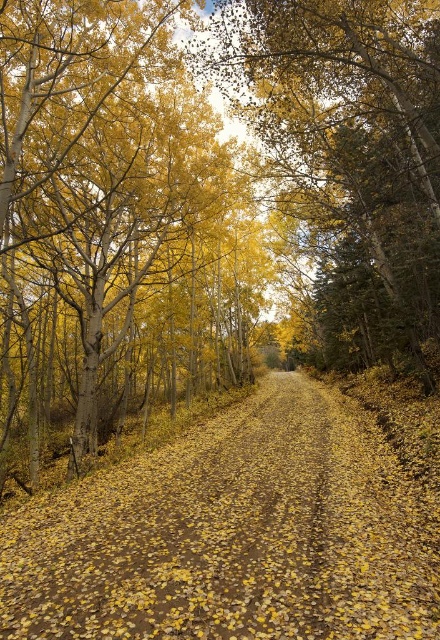
You are a hiker walking along the yellow leafy dirt path at center and the golden textured leaves at center. Which object appears smaller in the scene?

The yellow leafy dirt path at center appears smaller than the golden textured leaves at center in the scene.

You are a hiker walking along the yellow leafy dirt path at center and the golden textured leaves at center. Which one is lower from the ground?

The yellow leafy dirt path at center is lower from the ground compared to the golden textured leaves at center.